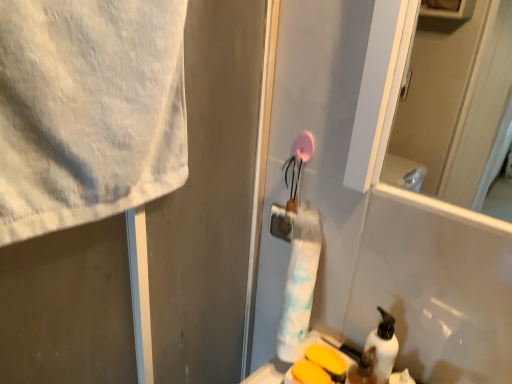
Question: Is yellow matte soap at lower center directly adjacent to white matte towel at upper left?

Choices:
 (A) no
 (B) yes

Answer: (A)

Question: Is white matte towel at upper left surrounded by yellow matte soap at lower center?

Choices:
 (A) no
 (B) yes

Answer: (A)

Question: Does yellow matte soap at lower center appear on the left side of white matte towel at upper left?

Choices:
 (A) no
 (B) yes

Answer: (A)

Question: From the image's perspective, is yellow matte soap at lower center above white matte towel at upper left?

Choices:
 (A) yes
 (B) no

Answer: (B)

Question: Is yellow matte soap at lower center closer to the viewer compared to white matte towel at upper left?

Choices:
 (A) yes
 (B) no

Answer: (B)

Question: From the image's perspective, is yellow matte soap at lower center positioned above or below translucent plastic soap dispenser at lower right?

Choices:
 (A) above
 (B) below

Answer: (B)

Question: Which is correct: yellow matte soap at lower center is inside translucent plastic soap dispenser at lower right, or outside of it?

Choices:
 (A) outside
 (B) inside

Answer: (A)

Question: Is yellow matte soap at lower center taller or shorter than translucent plastic soap dispenser at lower right?

Choices:
 (A) tall
 (B) short

Answer: (B)

Question: Is yellow matte soap at lower center wider or thinner than translucent plastic soap dispenser at lower right?

Choices:
 (A) thin
 (B) wide

Answer: (B)

Question: Is white matte towel at upper left situated inside yellow matte soap at lower center or outside?

Choices:
 (A) inside
 (B) outside

Answer: (B)

Question: Is point (239, 296) closer or farther from the camera than point (294, 362)?

Choices:
 (A) farther
 (B) closer

Answer: (A)

Question: Based on their sizes in the image, would you say white matte towel at upper left is bigger or smaller than yellow matte soap at lower center?

Choices:
 (A) big
 (B) small

Answer: (A)

Question: Considering the positions of white matte towel at upper left and yellow matte soap at lower center in the image, is white matte towel at upper left taller or shorter than yellow matte soap at lower center?

Choices:
 (A) short
 (B) tall

Answer: (B)

Question: Choose the correct answer: Is white matte pump bottle at lower right inside white matte towel at upper left or outside it?

Choices:
 (A) outside
 (B) inside

Answer: (A)

Question: From their relative heights in the image, would you say white matte pump bottle at lower right is taller or shorter than white matte towel at upper left?

Choices:
 (A) tall
 (B) short

Answer: (B)